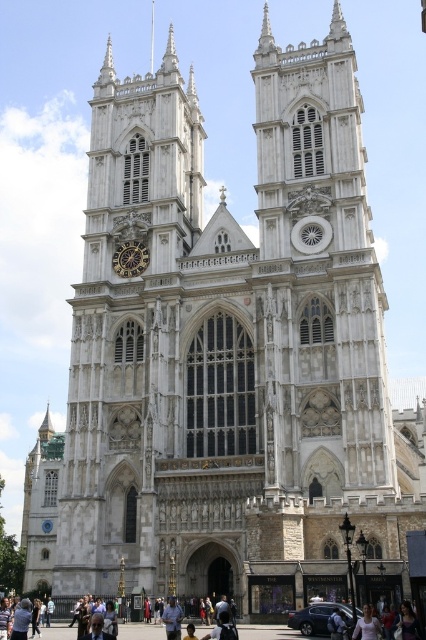
You are standing in front of Westminster Abbey and want to take a photo of the goldmetallicclock at left and the white matte shirt at lower center. Which object should you focus on first to ensure both are in the frame?

You should focus on the goldmetallicclock at left first because it is closer to you than the white matte shirt at lower center, ensuring both are in the frame.

You are standing in front of Westminster Abbey and notice the goldmetallicclock at left and the light blue jeans at center. From your perspective, which object is positioned higher?

The goldmetallicclock at left is above the light blue jeans at center, so it is positioned higher.

In the scene shown: You are standing in front of Westminster Abbey and want to locate the goldmetallicclock at left. According to the coordinates provided, where should you look relative to the central entrance?

The goldmetallicclock at left is located at coordinates point [131,259], which is to the left of the central entrance.